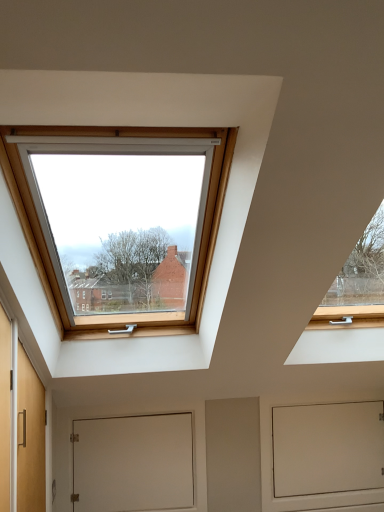
Question: In terms of height, does white matte door at center look taller or shorter compared to white matte screen door at lower center?

Choices:
 (A) tall
 (B) short

Answer: (B)

Question: Is white matte door at center wider or thinner than white matte screen door at lower center?

Choices:
 (A) thin
 (B) wide

Answer: (A)

Question: From the image's perspective, is white matte door at center located above or below white matte screen door at lower center?

Choices:
 (A) above
 (B) below

Answer: (A)

Question: Is white matte screen door at lower center inside the boundaries of white matte door at center, or outside?

Choices:
 (A) outside
 (B) inside

Answer: (A)

Question: In terms of size, does white matte screen door at lower center appear bigger or smaller than white matte door at center?

Choices:
 (A) big
 (B) small

Answer: (A)

Question: Is white matte screen door at lower center wider or thinner than white matte door at center?

Choices:
 (A) thin
 (B) wide

Answer: (B)

Question: From a real-world perspective, is white matte screen door at lower center above or below white matte door at center?

Choices:
 (A) below
 (B) above

Answer: (A)